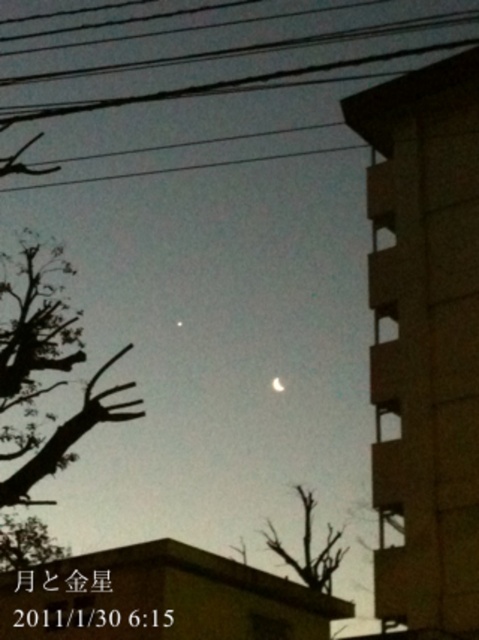
You are an astronomer observing the eclipse and notice the black wire at upper center and the bright silver moon at center. Which object is positioned higher in the sky?

The black wire at upper center is positioned higher in the sky than the bright silver moon at center.

What are the coordinates of the black wire at upper center?

The coordinates of the black wire at upper center are at point (255, 48).